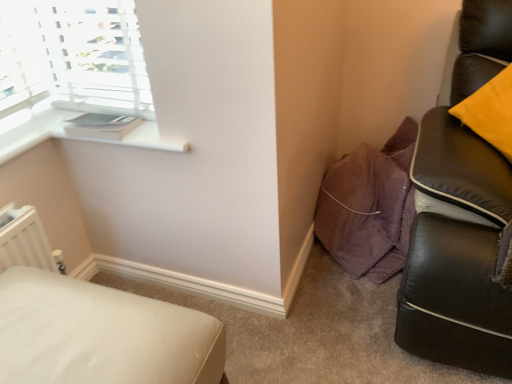
At what (x,y) coordinates should I click in order to perform the action: click on white matte window sill at upper left. Please return your answer as a coordinate pair (x, y). This screenshot has height=384, width=512. Looking at the image, I should click on (72, 137).

This screenshot has width=512, height=384. Describe the element at coordinates (72, 137) in the screenshot. I see `white matte window sill at upper left` at that location.

Describe the element at coordinates (100, 334) in the screenshot. The width and height of the screenshot is (512, 384). I see `white fabric ottoman at lower left` at that location.

Locate an element on the screen. The height and width of the screenshot is (384, 512). white fabric ottoman at lower left is located at coordinates (100, 334).

Measure the distance between point (128,317) and camera.

Point (128,317) and camera are 35.67 inches apart.

At what (x,y) coordinates should I click in order to perform the action: click on white matte window sill at upper left. Please return your answer as a coordinate pair (x, y). Looking at the image, I should click on (72, 137).

Is white fabric ottoman at lower left at the left side of white matte window sill at upper left?

Yes.

Does white fabric ottoman at lower left lie behind white matte window sill at upper left?

No, white fabric ottoman at lower left is closer to the camera.

Does point (130, 312) lie in front of point (10, 127)?

Yes.

From the image's perspective, who appears lower, white fabric ottoman at lower left or white matte window sill at upper left?

white fabric ottoman at lower left is shown below in the image.

From a real-world perspective, is white fabric ottoman at lower left positioned above or below white matte window sill at upper left?

In terms of real-world spatial position, white fabric ottoman at lower left is below white matte window sill at upper left.

Is white fabric ottoman at lower left thinner than white matte window sill at upper left?

In fact, white fabric ottoman at lower left might be wider than white matte window sill at upper left.

Who is taller, white fabric ottoman at lower left or white matte window sill at upper left?

With more height is white fabric ottoman at lower left.

Is white fabric ottoman at lower left smaller than white matte window sill at upper left?

Actually, white fabric ottoman at lower left might be larger than white matte window sill at upper left.

Does white fabric ottoman at lower left contain white matte window sill at upper left?

No, white matte window sill at upper left is not surrounded by white fabric ottoman at lower left.

Would you say white fabric ottoman at lower left is a long distance from white matte window sill at upper left?

No, white fabric ottoman at lower left is in close proximity to white matte window sill at upper left.

Is white fabric ottoman at lower left looking in the opposite direction of white matte window sill at upper left?

That's not correct — white fabric ottoman at lower left is not looking away from white matte window sill at upper left.

Where is `furniture that appears below the white matte window sill at upper left (from a real-world perspective)`? This screenshot has width=512, height=384. furniture that appears below the white matte window sill at upper left (from a real-world perspective) is located at coordinates (100, 334).

Which object is positioned more to the left, white matte window sill at upper left or white fabric ottoman at lower left?

white fabric ottoman at lower left is more to the left.

Does white matte window sill at upper left lie in front of white fabric ottoman at lower left?

No, white matte window sill at upper left is further to the viewer.

Is point (147, 138) less distant than point (14, 288)?

No, it is not.

From the image's perspective, does white matte window sill at upper left appear lower than white fabric ottoman at lower left?

Incorrect, from the image's perspective, white matte window sill at upper left is higher than white fabric ottoman at lower left.

From a real-world perspective, does white matte window sill at upper left stand above white fabric ottoman at lower left?

Yes, from a real-world perspective, white matte window sill at upper left is above white fabric ottoman at lower left.

Is white matte window sill at upper left wider than white fabric ottoman at lower left?

No, white matte window sill at upper left is not wider than white fabric ottoman at lower left.

In the scene shown: Which of these two, white matte window sill at upper left or white fabric ottoman at lower left, stands shorter?

white matte window sill at upper left is shorter.

Which of these two, white matte window sill at upper left or white fabric ottoman at lower left, is smaller?

white matte window sill at upper left is smaller.

Would you say white fabric ottoman at lower left is part of white matte window sill at upper left's contents?

Definitely not — white fabric ottoman at lower left is not inside white matte window sill at upper left.

Is white matte window sill at upper left in contact with white fabric ottoman at lower left?

No, white matte window sill at upper left is not beside white fabric ottoman at lower left.

In the scene shown: Is white matte window sill at upper left facing away from white fabric ottoman at lower left?

white matte window sill at upper left does not have its back to white fabric ottoman at lower left.

What's the angular difference between white matte window sill at upper left and white fabric ottoman at lower left's facing directions?

There is a 1.04-degree angle between the facing directions of white matte window sill at upper left and white fabric ottoman at lower left.

How much distance is there between white matte window sill at upper left and white fabric ottoman at lower left?

white matte window sill at upper left is 21.66 inches from white fabric ottoman at lower left.

Where is `furniture that appears on the left of white matte window sill at upper left`? The width and height of the screenshot is (512, 384). furniture that appears on the left of white matte window sill at upper left is located at coordinates (100, 334).

I want to click on window sill on the right side of white fabric ottoman at lower left, so click(x=72, y=137).

At what (x,y) coordinates should I click in order to perform the action: click on window sill behind the white fabric ottoman at lower left. Please return your answer as a coordinate pair (x, y). This screenshot has width=512, height=384. Looking at the image, I should click on point(72,137).